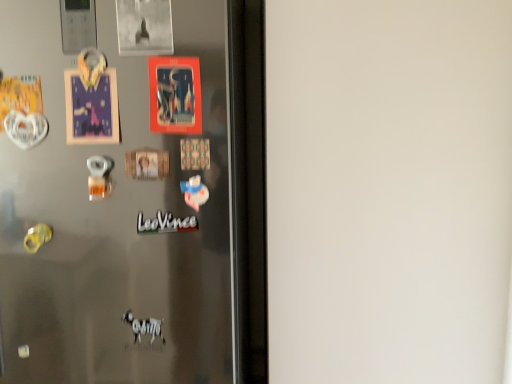
Question: Can you confirm if white matte sticker at center is bigger than satin metallic fridge at center?

Choices:
 (A) no
 (B) yes

Answer: (A)

Question: Would you say white matte sticker at center contains satin metallic fridge at center?

Choices:
 (A) yes
 (B) no

Answer: (B)

Question: From a real-world perspective, is white matte sticker at center under satin metallic fridge at center?

Choices:
 (A) no
 (B) yes

Answer: (A)

Question: Can you confirm if white matte sticker at center is smaller than satin metallic fridge at center?

Choices:
 (A) no
 (B) yes

Answer: (B)

Question: Could you tell me if white matte sticker at center is turned towards satin metallic fridge at center?

Choices:
 (A) no
 (B) yes

Answer: (B)

Question: Does point (58, 3) appear closer or farther from the camera than point (160, 223)?

Choices:
 (A) farther
 (B) closer

Answer: (A)

Question: In terms of width, does satin metallic fridge at center look wider or thinner when compared to white matte sticker at center?

Choices:
 (A) wide
 (B) thin

Answer: (A)

Question: Considering the positions of satin metallic fridge at center and white matte sticker at center in the image, is satin metallic fridge at center taller or shorter than white matte sticker at center?

Choices:
 (A) tall
 (B) short

Answer: (A)

Question: From a real-world perspective, is satin metallic fridge at center positioned above or below white matte sticker at center?

Choices:
 (A) above
 (B) below

Answer: (B)

Question: Choose the correct answer: Is white matte sticker at center inside satin metallic fridge at center or outside it?

Choices:
 (A) outside
 (B) inside

Answer: (B)

Question: Considering their positions, is white matte sticker at center located in front of or behind satin metallic fridge at center?

Choices:
 (A) behind
 (B) front

Answer: (A)

Question: From the image's perspective, is white matte sticker at center located above or below satin metallic fridge at center?

Choices:
 (A) above
 (B) below

Answer: (A)

Question: Considering the positions of white matte sticker at center and satin metallic fridge at center in the image, is white matte sticker at center bigger or smaller than satin metallic fridge at center?

Choices:
 (A) big
 (B) small

Answer: (B)

Question: Considering their positions, is white matte sticker at center located in front of or behind matte plastic postcard at center?

Choices:
 (A) behind
 (B) front

Answer: (A)

Question: Is white matte sticker at center inside the boundaries of matte plastic postcard at center, or outside?

Choices:
 (A) inside
 (B) outside

Answer: (B)